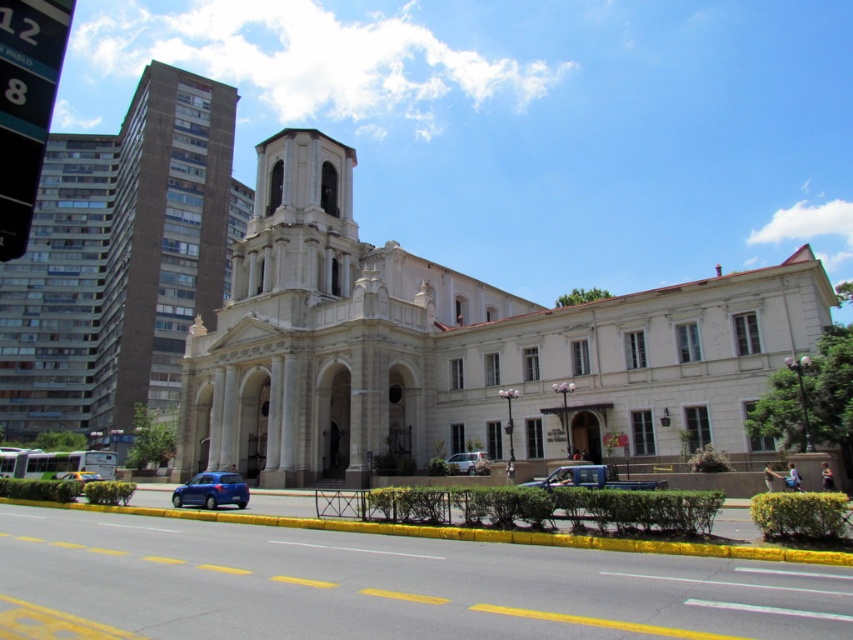
Question: From the image, what is the correct spatial relationship of blue matte car at lower left in relation to satin silver sedan at center?

Choices:
 (A) left
 (B) right

Answer: (A)

Question: Where is brown concrete building at left located in relation to metallic blue car at center in the image?

Choices:
 (A) above
 (B) below

Answer: (A)

Question: Among these points, which one is nearest to the camera?

Choices:
 (A) (440, 308)
 (B) (473, 468)
 (C) (560, 484)

Answer: (C)

Question: Which object is the farthest from the metallic blue car at center?

Choices:
 (A) brown concrete building at left
 (B) white stone church at center
 (C) blue matte car at lower left
 (D) blue metallic truck at center

Answer: (A)

Question: Which of the following is the farthest from the observer?

Choices:
 (A) blue metallic truck at center
 (B) brown concrete building at left
 (C) white stone church at center

Answer: (B)

Question: Can you confirm if white stone church at center is positioned to the left of blue matte car at lower left?

Choices:
 (A) no
 (B) yes

Answer: (A)